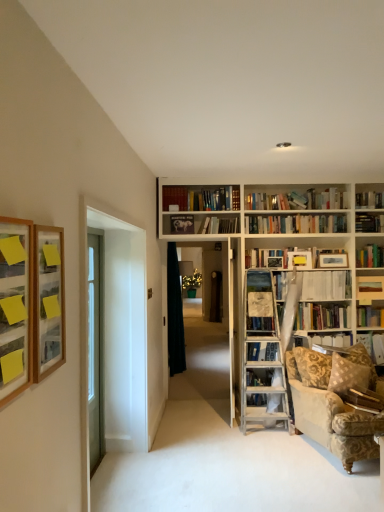
Where is `hardcover book at right, which is counted as the 2th book, starting from the bottom`? hardcover book at right, which is counted as the 2th book, starting from the bottom is located at coordinates (373, 345).

What do you see at coordinates (182, 224) in the screenshot? The image size is (384, 512). I see `matte black picture frame at upper center, which is the first picture frame from back to front` at bounding box center [182, 224].

Where is `wooden bookshelf at center`? This screenshot has height=512, width=384. wooden bookshelf at center is located at coordinates (221, 301).

Find the location of `wooden book at right, which is the 1th book in front-to-back order`. wooden book at right, which is the 1th book in front-to-back order is located at coordinates (364, 399).

In order to click on hardcover book at right, marked as the 4th book in a top-to-bottom arrangement in this screenshot , I will do `click(373, 345)`.

Between wooden picture frame at left, placed as the third picture frame when sorted from back to front, and velvet beige couch at lower right, which one appears on the left side from the viewer's perspective?

wooden picture frame at left, placed as the third picture frame when sorted from back to front, is more to the left.

From the picture: Is wooden picture frame at left, the 1th picture frame positioned from the left, smaller than velvet beige couch at lower right?

Correct, wooden picture frame at left, the 1th picture frame positioned from the left, occupies less space than velvet beige couch at lower right.

Is point (19, 381) positioned in front of point (338, 422)?

Yes, it is in front of point (338, 422).

Find the location of a particular element. This screenshot has height=512, width=384. bookstore behind the wooden book at right, marked as the fifth book in a top-to-bottom arrangement is located at coordinates (221, 301).

How many degrees apart are the facing directions of wooden book at right, the 3th book viewed from the right, and wooden bookshelf at center?

There is a 5.09-degree angle between the facing directions of wooden book at right, the 3th book viewed from the right, and wooden bookshelf at center.

Is point (365, 392) farther from viewer compared to point (224, 300)?

No, (365, 392) is in front of (224, 300).

From a real-world perspective, is velvet beige couch at lower right located higher than wooden bookshelf at upper right, arranged as the third book when viewed from the top?

No, from a real-world perspective, velvet beige couch at lower right is not over wooden bookshelf at upper right, arranged as the third book when viewed from the top

Is point (316, 409) farther from viewer compared to point (362, 280)?

No, (316, 409) is in front of (362, 280).

Who is taller, velvet beige couch at lower right or wooden bookshelf at upper right, which ranks as the 2th book in back-to-front order?

velvet beige couch at lower right.

Is velvet beige couch at lower right positioned before wooden bookshelf at upper right, arranged as the third book when viewed from the top?

Yes, velvet beige couch at lower right is closer to the viewer.

Are wooden bookshelf at center and matte black picture frame at upper center, positioned as the third picture frame in front-to-back order, located far from each other?

Absolutely, wooden bookshelf at center is distant from matte black picture frame at upper center, positioned as the third picture frame in front-to-back order.

From the image's perspective, which object appears higher, wooden bookshelf at center or matte black picture frame at upper center, acting as the first picture frame starting from the right?

From the image's view, matte black picture frame at upper center, acting as the first picture frame starting from the right, is above.

Is the depth of wooden bookshelf at center less than that of matte black picture frame at upper center, positioned as the third picture frame in left-to-right order?

No, it is not.

In terms of width, does wooden bookshelf at center look wider or thinner when compared to matte black picture frame at upper center, positioned as the third picture frame in front-to-back order?

Clearly, wooden bookshelf at center has more width compared to matte black picture frame at upper center, positioned as the third picture frame in front-to-back order.

Between white paper book at upper center, placed as the fourth book when sorted from right to left, and black fabric curtain at center, which one has larger size?

With larger size is black fabric curtain at center.

Could you tell me if white paper book at upper center, placed as the fourth book when sorted from right to left, is facing black fabric curtain at center?

No, white paper book at upper center, placed as the fourth book when sorted from right to left, is not turned towards black fabric curtain at center.

Is white paper book at upper center, which is the second book in left-to-right order, closer to the viewer compared to black fabric curtain at center?

Yes, it is.

From the image's perspective, between black fabric curtain at center and hardcover book at right, which is counted as the 2th book, starting from the bottom, which one is located above?

black fabric curtain at center is shown above in the image.

Can you confirm if black fabric curtain at center is bigger than hardcover book at right, the 3th book from the back?

Indeed, black fabric curtain at center has a larger size compared to hardcover book at right, the 3th book from the back.

Is black fabric curtain at center to the left or to the right of hardcover book at right, the 3th book from the back, in the image?

Based on their positions, black fabric curtain at center is located to the left of hardcover book at right, the 3th book from the back.

Between black fabric curtain at center and hardcover book at right, placed as the fifth book when sorted from left to right, which one is positioned behind?

black fabric curtain at center is further away from the camera.

From a real-world perspective, is velvet beige couch at lower right under hardcover book at upper center, which appears as the 5th book when ordered from the bottom?

Yes, from a real-world perspective, velvet beige couch at lower right is under hardcover book at upper center, which appears as the 5th book when ordered from the bottom.

Does velvet beige couch at lower right appear on the right side of hardcover book at upper center, arranged as the 1th book when viewed from the left?

Correct, you'll find velvet beige couch at lower right to the right of hardcover book at upper center, arranged as the 1th book when viewed from the left.

Which is behind, point (347, 435) or point (227, 230)?

Positioned behind is point (227, 230).

From the image's perspective, would you say velvet beige couch at lower right is shown under hardcover book at upper center, which is the 5th book in front-to-back order?

Indeed, from the image's perspective, velvet beige couch at lower right is shown beneath hardcover book at upper center, which is the 5th book in front-to-back order.

Identify the location of studio couch lying below the wooden picture frame at left, which ranks as the first picture frame in front-to-back order (from the image's perspective). click(329, 410).

This screenshot has width=384, height=512. Find the location of `bookstore located above the wooden book at right, marked as the fifth book in a top-to-bottom arrangement (from a real-world perspective)`. bookstore located above the wooden book at right, marked as the fifth book in a top-to-bottom arrangement (from a real-world perspective) is located at coordinates (221, 301).

Looking at the image, which one is located further to clear glass door at left, clear glass door at left or hardcover book at right, which is the first book from right to left?

hardcover book at right, which is the first book from right to left, is positioned further to the anchor clear glass door at left.

Looking at this image, estimate the real-world distances between objects in this image. Which object is closer to matte black picture frame at upper center, acting as the first picture frame starting from the right, hardcover book at right, which is counted as the 2th book, starting from the bottom, or wooden bookshelf at upper right, the fourth book when ordered from left to right?

Among the two, wooden bookshelf at upper right, the fourth book when ordered from left to right, is located nearer to matte black picture frame at upper center, acting as the first picture frame starting from the right.

Estimate the real-world distances between objects in this image. Which object is closer to black fabric curtain at center, white paper book at upper center, which is the second book in left-to-right order, or clear glass door at left?

white paper book at upper center, which is the second book in left-to-right order.

Looking at the image, which one is located further to hardcover book at right, placed as the fifth book when sorted from left to right, wooden picture frame at left, the 2th picture frame viewed from the right, or hardcover book at upper center, which is counted as the fifth book, starting from the right?

wooden picture frame at left, the 2th picture frame viewed from the right.

Consider the image. Based on their spatial positions, is matte black picture frame at upper center, positioned as the third picture frame in front-to-back order, or wooden bookshelf at upper right, the fourth book when ordered from left to right, further from wooden book at right, which is the 1th book in front-to-back order?

matte black picture frame at upper center, positioned as the third picture frame in front-to-back order.

From the image, which object appears to be farther from black fabric curtain at center, hardcover book at right, which is the first book from right to left, or wooden bookshelf at center?

The object further to black fabric curtain at center is hardcover book at right, which is the first book from right to left.

From the image, which object appears to be nearer to clear glass door at left, black fabric curtain at center or wooden picture frame at left, placed as the third picture frame when sorted from back to front?

black fabric curtain at center is closer to clear glass door at left.

Consider the image. Considering their positions, is velvet beige couch at lower right positioned further to black fabric curtain at center than clear glass door at left?

velvet beige couch at lower right.

I want to click on picture frame positioned between wooden picture frame at left, the 2th picture frame when ordered from front to back, and wooden bookshelf at upper right, the fourth book when ordered from left to right, from near to far, so click(x=182, y=224).

Where is `picture frame located between clear glass door at left and wooden bookshelf at center in the depth direction`? The height and width of the screenshot is (512, 384). picture frame located between clear glass door at left and wooden bookshelf at center in the depth direction is located at coordinates (182, 224).

Image resolution: width=384 pixels, height=512 pixels. I want to click on glass door between clear glass door at left and hardcover book at right, which is the first book from right to left, so click(116, 328).

Find the location of a particular element. book between velvet beige couch at lower right and white paper book at upper center, which ranks as the fourth book in bottom-to-top order, along the z-axis is located at coordinates (364, 399).